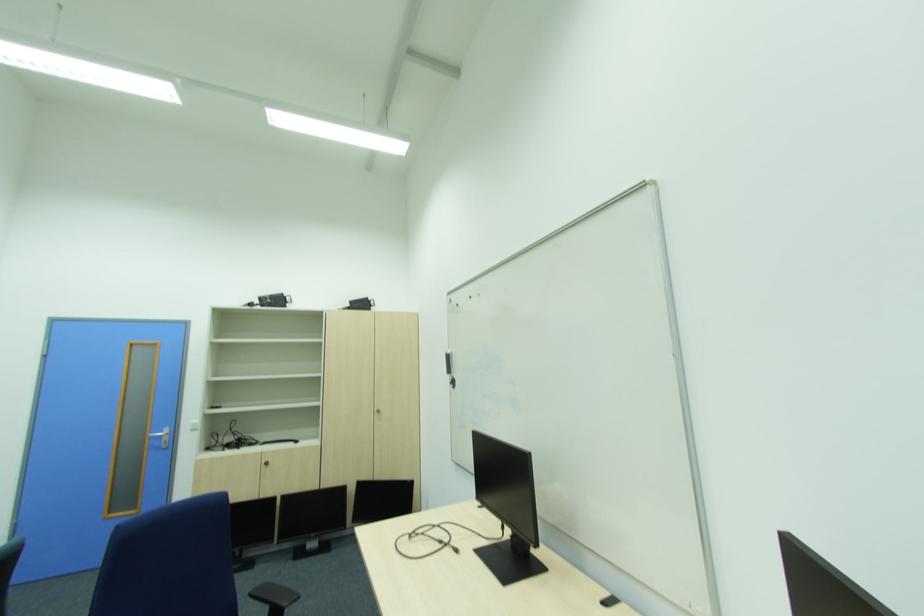
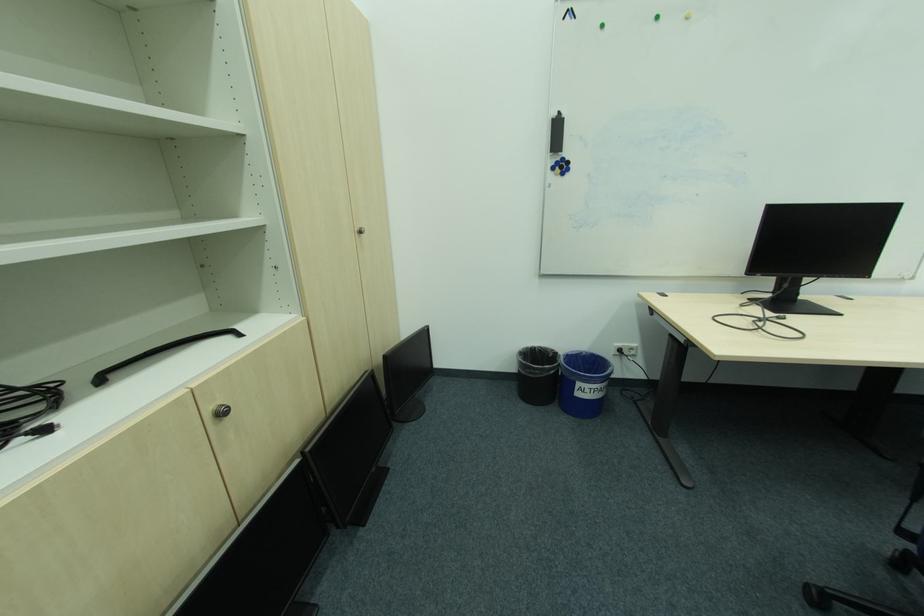
The point at [274,464] is marked in the first image. Where is the corresponding point in the second image?

(227, 415)